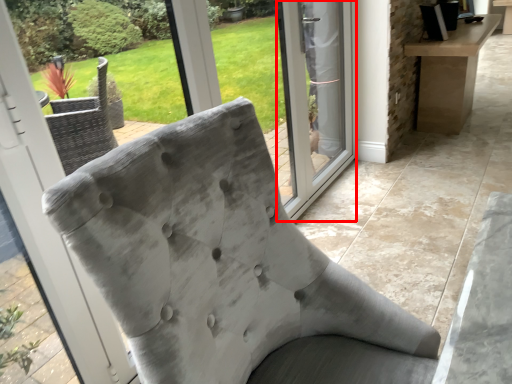
Question: From the image's perspective, what is the correct spatial relationship of screen door (annotated by the red box) in relation to chair?

Choices:
 (A) above
 (B) below

Answer: (A)